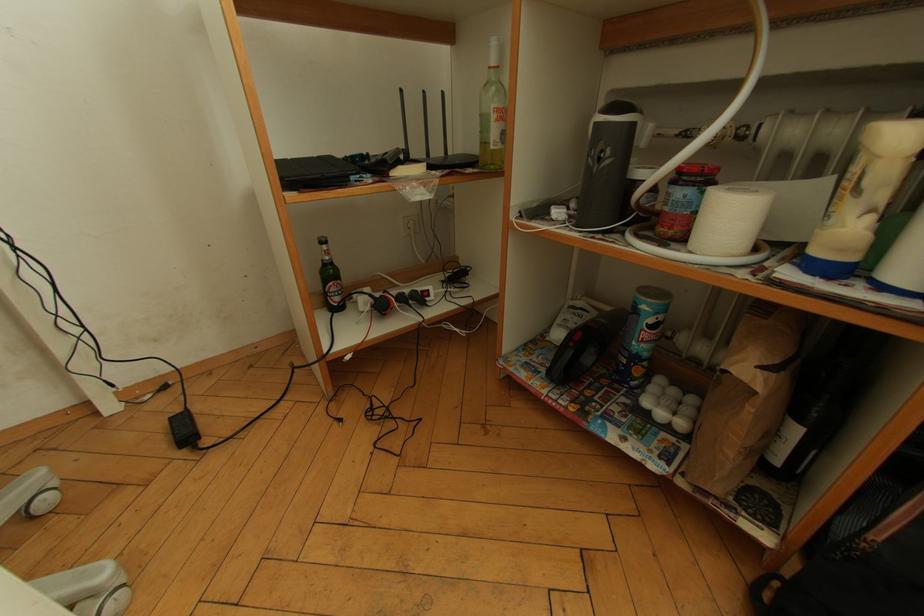
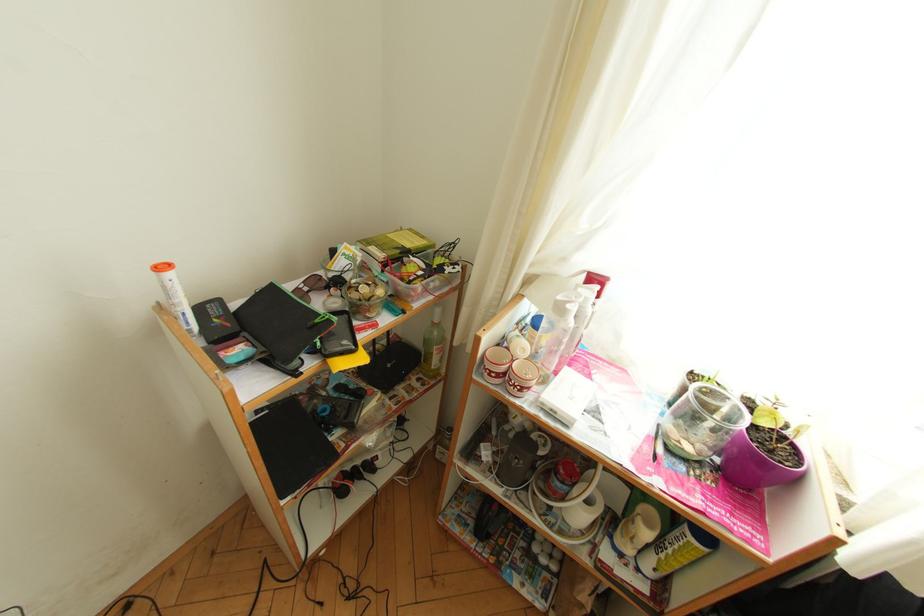
In a continuous first-person perspective shot, in which direction is the camera moving?

The cameraman moved toward left, backward.